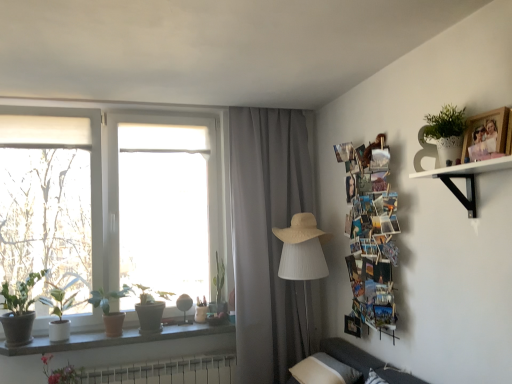
Where is `free spot above gray fabric curtain at center (from a real-world perspective)`? The height and width of the screenshot is (384, 512). free spot above gray fabric curtain at center (from a real-world perspective) is located at coordinates (268, 105).